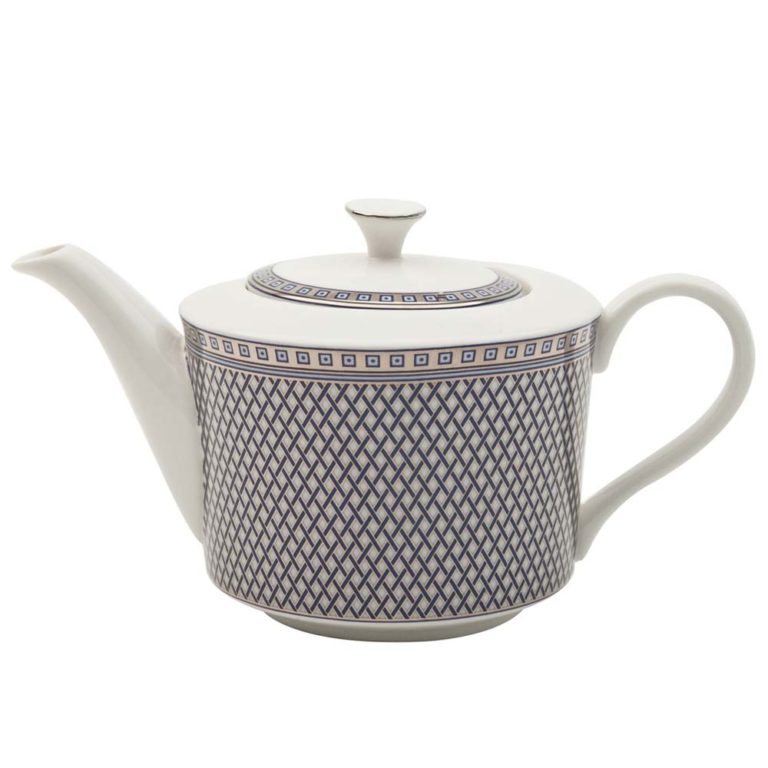
Locate an element on the screen. teapot spout is located at coordinates (121, 335).